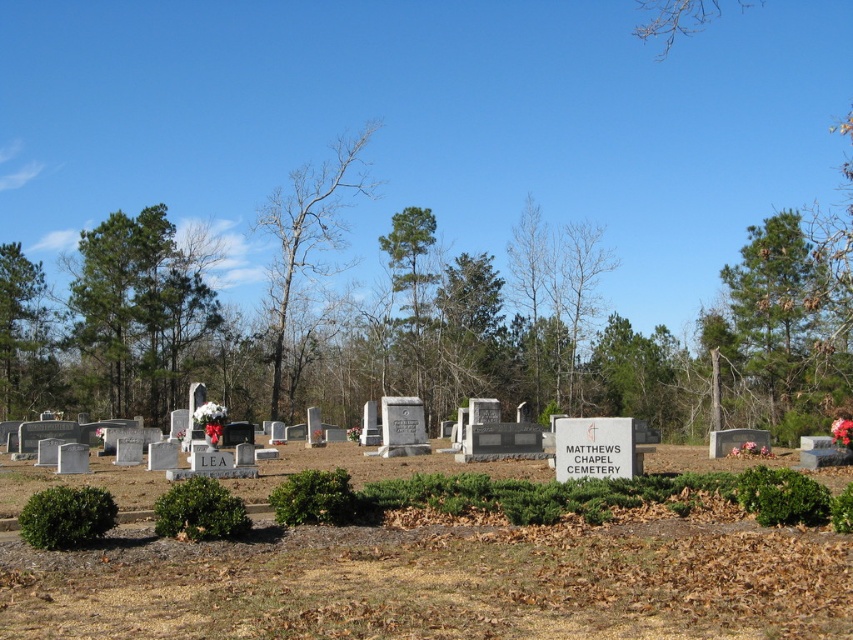
Is point (740, 355) farther from viewer compared to point (320, 227)?

No.

Which is more to the left, green leafy tree at upper right or bare wood tree at center?

bare wood tree at center

Locate an element on the screen. This screenshot has height=640, width=853. green leafy tree at upper right is located at coordinates (784, 326).

Can you confirm if green leafy tree at left is positioned above green leafy tree at center?

Actually, green leafy tree at left is below green leafy tree at center.

You are a GUI agent. You are given a task and a screenshot of the screen. Output one action in this format:
    pyautogui.click(x=<x>, y=<y>)
    Task: Click on the green leafy tree at left
    The image size is (853, 640).
    Given the screenshot: What is the action you would take?
    pyautogui.click(x=22, y=337)

Is point (776, 275) more distant than point (19, 301)?

No, (776, 275) is closer to viewer.

Is green leafy tree at upper right shorter than green leafy tree at left?

In fact, green leafy tree at upper right may be taller than green leafy tree at left.

Who is more distant from viewer, (x=740, y=369) or (x=30, y=316)?

The point (x=30, y=316) is behind.

I want to click on green leafy tree at upper right, so click(x=784, y=326).